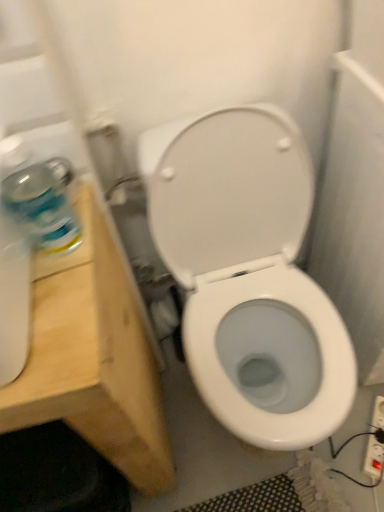
Question: Does white glossy toilet at center turn towards light wood vanity at left?

Choices:
 (A) yes
 (B) no

Answer: (B)

Question: Considering the relative sizes of white glossy toilet at center and light wood vanity at left in the image provided, is white glossy toilet at center taller than light wood vanity at left?

Choices:
 (A) yes
 (B) no

Answer: (B)

Question: Is white glossy toilet at center to the left of light wood vanity at left from the viewer's perspective?

Choices:
 (A) yes
 (B) no

Answer: (B)

Question: Can you confirm if white glossy toilet at center is wider than light wood vanity at left?

Choices:
 (A) no
 (B) yes

Answer: (B)

Question: Does white glossy toilet at center come in front of light wood vanity at left?

Choices:
 (A) no
 (B) yes

Answer: (A)

Question: Is point (165, 176) positioned closer to the camera than point (29, 210)?

Choices:
 (A) farther
 (B) closer

Answer: (A)

Question: Is white glossy toilet at center in front of or behind clear plastic bottle at left in the image?

Choices:
 (A) front
 (B) behind

Answer: (B)

Question: In terms of height, does white glossy toilet at center look taller or shorter compared to clear plastic bottle at left?

Choices:
 (A) tall
 (B) short

Answer: (A)

Question: Based on their sizes in the image, would you say white glossy toilet at center is bigger or smaller than clear plastic bottle at left?

Choices:
 (A) big
 (B) small

Answer: (A)

Question: Looking at their shapes, would you say light wood vanity at left is wider or thinner than clear plastic bottle at left?

Choices:
 (A) thin
 (B) wide

Answer: (B)

Question: Considering the positions of light wood vanity at left and clear plastic bottle at left in the image, is light wood vanity at left taller or shorter than clear plastic bottle at left?

Choices:
 (A) short
 (B) tall

Answer: (B)

Question: From a real-world perspective, is light wood vanity at left above or below clear plastic bottle at left?

Choices:
 (A) above
 (B) below

Answer: (B)

Question: Is point (94, 410) closer or farther from the camera than point (49, 233)?

Choices:
 (A) closer
 (B) farther

Answer: (B)

Question: Considering the positions of white plastic electrical outlet at lower right and light wood vanity at left in the image, is white plastic electrical outlet at lower right wider or thinner than light wood vanity at left?

Choices:
 (A) thin
 (B) wide

Answer: (A)

Question: From the image's perspective, is white plastic electrical outlet at lower right positioned above or below light wood vanity at left?

Choices:
 (A) above
 (B) below

Answer: (B)